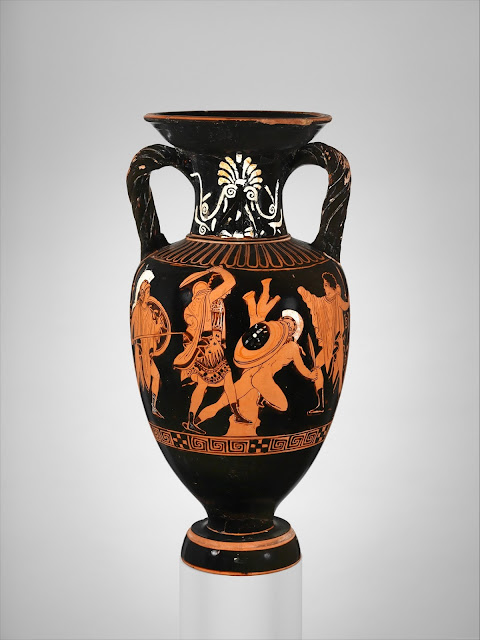
Image resolution: width=480 pixels, height=640 pixels. I want to click on black vase, so click(x=307, y=397), click(x=266, y=141).